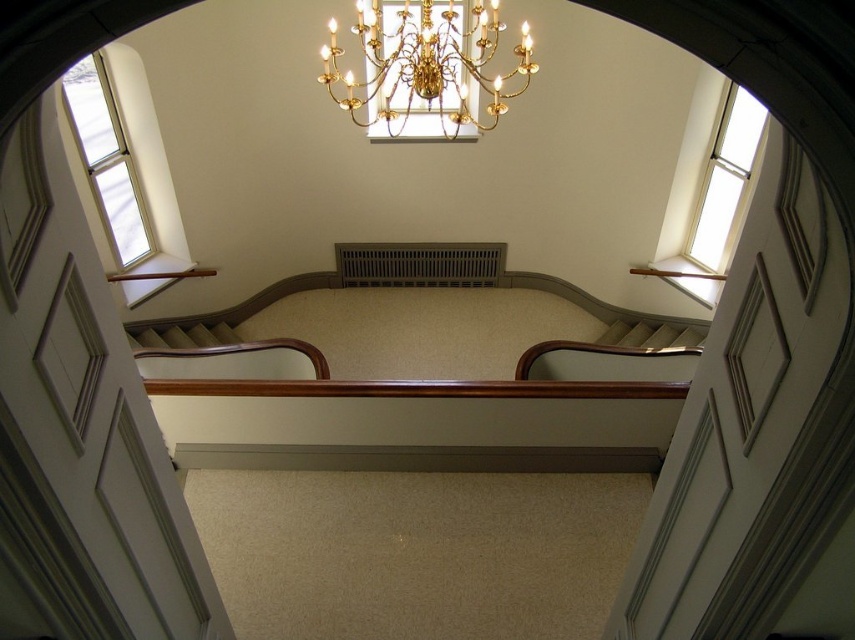
Does gold metallic chandelier at upper center have a smaller size compared to white glass window at upper left?

No, gold metallic chandelier at upper center is not smaller than white glass window at upper left.

Based on the photo, between gold metallic chandelier at upper center and white glass window at upper left, which one appears on the right side from the viewer's perspective?

gold metallic chandelier at upper center

Locate an element on the screen. The image size is (855, 640). gold metallic chandelier at upper center is located at coordinates (425, 65).

Does gold metallic chandelier at upper center have a smaller size compared to clear glass window at upper right?

Actually, gold metallic chandelier at upper center might be larger than clear glass window at upper right.

Can you confirm if gold metallic chandelier at upper center is positioned above clear glass window at upper right?

Indeed, gold metallic chandelier at upper center is positioned over clear glass window at upper right.

Find the location of `gold metallic chandelier at upper center`. gold metallic chandelier at upper center is located at coordinates (425, 65).

Is white glass window at upper left thinner than clear glass window at upper right?

Indeed, white glass window at upper left has a lesser width compared to clear glass window at upper right.

Is white glass window at upper left to the right of clear glass window at upper right from the viewer's perspective?

No, white glass window at upper left is not to the right of clear glass window at upper right.

Image resolution: width=855 pixels, height=640 pixels. Find the location of `white glass window at upper left`. white glass window at upper left is located at coordinates (105, 160).

Where is `white glass window at upper left`? This screenshot has width=855, height=640. white glass window at upper left is located at coordinates (105, 160).